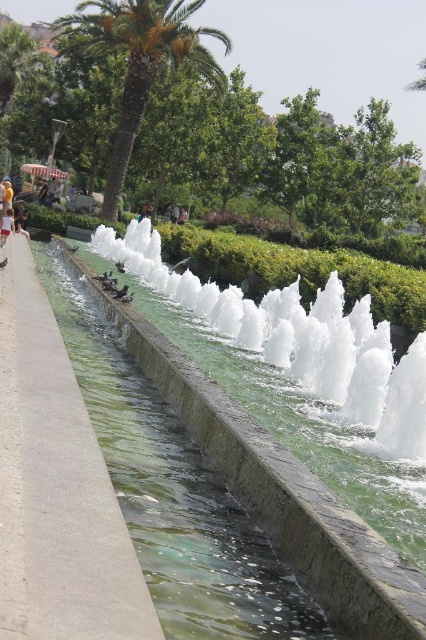
Question: Does gray concrete pavement at center appear on the right side of yellow fabric umbrella at upper left?

Choices:
 (A) yes
 (B) no

Answer: (A)

Question: Which point is farther to the camera?

Choices:
 (A) gray concrete pavement at center
 (B) green leafy palm tree at upper left

Answer: (B)

Question: Does gray concrete pavement at center appear under yellow fabric umbrella at upper left?

Choices:
 (A) yes
 (B) no

Answer: (A)

Question: Which point appears farthest from the camera in this image?

Choices:
 (A) (134, 29)
 (B) (20, 216)

Answer: (A)

Question: Which object is farther from the camera taking this photo?

Choices:
 (A) yellow fabric umbrella at upper left
 (B) green leafy palm tree at upper left
 (C) clear glass water at center

Answer: (B)

Question: Is gray concrete pavement at center below white cotton shirt at center?

Choices:
 (A) no
 (B) yes

Answer: (B)